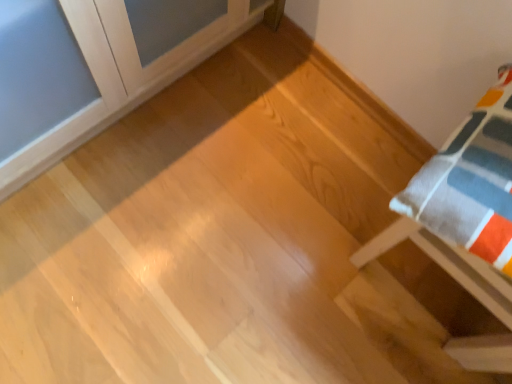
Question: Considering the positions of white cotton pillow at right, the first furniture positioned from the right, and light wood floor at upper left, positioned as the second furniture in right-to-left order, in the image, is white cotton pillow at right, the first furniture positioned from the right, taller or shorter than light wood floor at upper left, positioned as the second furniture in right-to-left order,?

Choices:
 (A) tall
 (B) short

Answer: (B)

Question: From the image's perspective, is white cotton pillow at right, which ranks as the second furniture in left-to-right order, above or below light wood floor at upper left, the first furniture in the left-to-right sequence?

Choices:
 (A) above
 (B) below

Answer: (B)

Question: Looking at their shapes, would you say white cotton pillow at right, the first furniture positioned from the right, is wider or thinner than light wood floor at upper left, the first furniture in the left-to-right sequence?

Choices:
 (A) wide
 (B) thin

Answer: (B)

Question: In terms of height, does light wood floor at upper left, positioned as the second furniture in right-to-left order, look taller or shorter compared to white cotton pillow at right, which ranks as the second furniture in left-to-right order?

Choices:
 (A) tall
 (B) short

Answer: (A)

Question: Is light wood floor at upper left, the first furniture in the left-to-right sequence, spatially inside white cotton pillow at right, the first furniture positioned from the right, or outside of it?

Choices:
 (A) outside
 (B) inside

Answer: (A)

Question: Looking at their shapes, would you say light wood floor at upper left, positioned as the second furniture in right-to-left order, is wider or thinner than white cotton pillow at right, the first furniture positioned from the right?

Choices:
 (A) thin
 (B) wide

Answer: (B)

Question: From the image's perspective, is light wood floor at upper left, positioned as the second furniture in right-to-left order, positioned above or below white cotton pillow at right, which ranks as the second furniture in left-to-right order?

Choices:
 (A) above
 (B) below

Answer: (A)